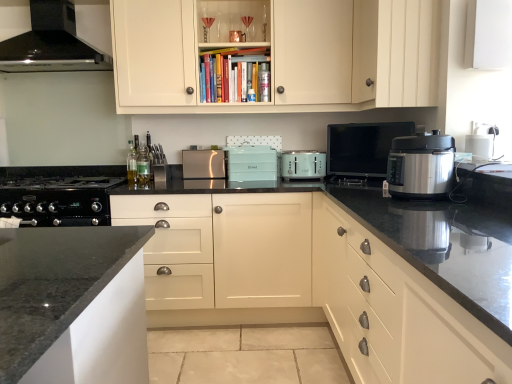
Where is `free location above satin silver toaster at center, which ranks as the fifth kitchen appliance in right-to-left order (from a real-world perspective)`? This screenshot has height=384, width=512. free location above satin silver toaster at center, which ranks as the fifth kitchen appliance in right-to-left order (from a real-world perspective) is located at coordinates (204, 147).